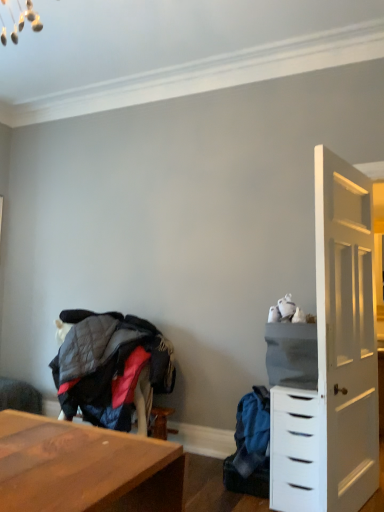
Question: Considering the positions of quilted fabric jacket at lower left, which is counted as the 1th clothing, starting from the left, and white matte chest of drawers at right in the image, is quilted fabric jacket at lower left, which is counted as the 1th clothing, starting from the left, taller or shorter than white matte chest of drawers at right?

Choices:
 (A) tall
 (B) short

Answer: (B)

Question: Does point (54, 376) appear closer or farther from the camera than point (283, 455)?

Choices:
 (A) closer
 (B) farther

Answer: (B)

Question: Which object is the farthest from the quilted fabric jacket at lower left, which is counted as the 1th clothing, starting from the left?

Choices:
 (A) wooden swivel chair at lower left
 (B) blue fabric backpack at lower right, positioned as the second clothing in left-to-right order
 (C) gray fabric cabinet at right
 (D) white matte chest of drawers at right

Answer: (D)

Question: Based on their relative distances, which object is farther from the white matte chest of drawers at right?

Choices:
 (A) wooden swivel chair at lower left
 (B) quilted fabric jacket at lower left, which is counted as the 2th clothing, starting from the right
 (C) gray fabric cabinet at right
 (D) blue fabric backpack at lower right, positioned as the second clothing in left-to-right order

Answer: (A)